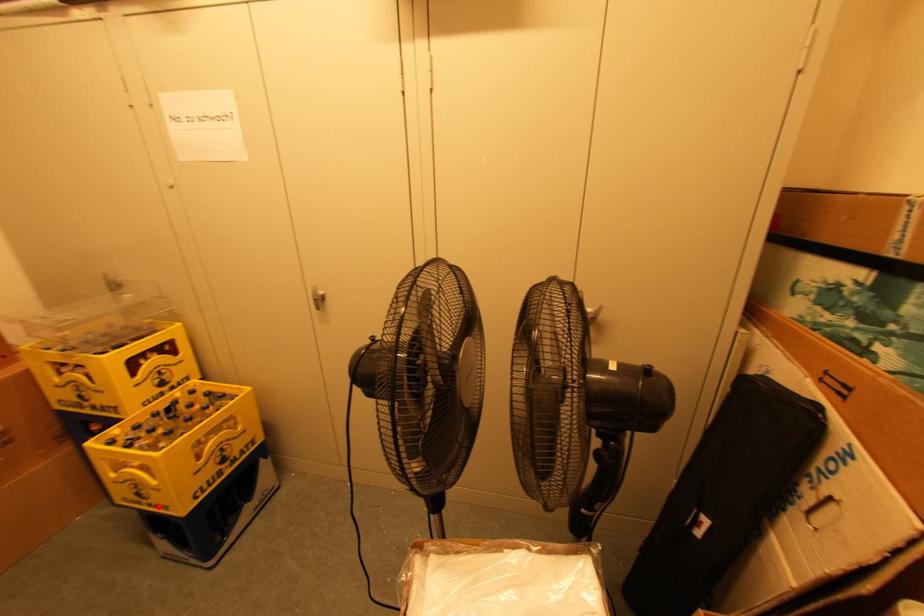
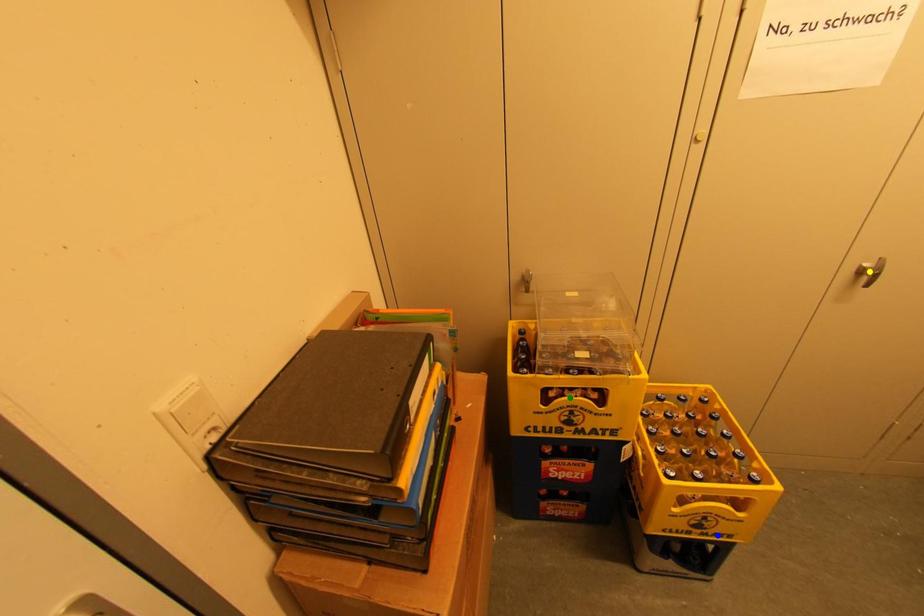
Question: I am providing you with two images of the same scene from different viewpoints. A red point is marked on the first image. You are given multiple points on the second image. Which point in image 2 represents the same 3d spot as the red point in image 1?

Choices:
 (A) green point
 (B) yellow point
 (C) blue point

Answer: (C)